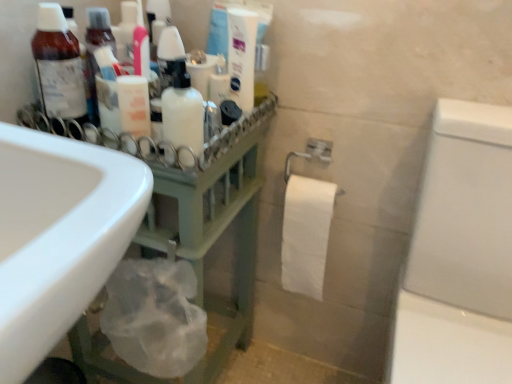
Identify the location of matte brown bottle at left. This screenshot has width=512, height=384. (58, 66).

In order to face matte brown bottle at left, should I rotate leftwards or rightwards?

Turn left by 24.702 degrees to look at matte brown bottle at left.

Image resolution: width=512 pixels, height=384 pixels. What are the coordinates of `white glossy toilet at right` in the screenshot? It's located at (460, 254).

Find the location of a particular element. The width and height of the screenshot is (512, 384). white glossy toothpaste tube at upper center is located at coordinates (242, 56).

What is the approximate height of white glossy toothpaste tube at upper center?

white glossy toothpaste tube at upper center is 8.11 inches tall.

Where is `white matte bottle at center`? white matte bottle at center is located at coordinates (183, 111).

This screenshot has height=384, width=512. I want to click on matte brown bottle at left, so click(58, 66).

Considering the positions of objects green matte rack at left and white glossy toothpaste tube at upper center in the image provided, who is more to the left, green matte rack at left or white glossy toothpaste tube at upper center?

green matte rack at left is more to the left.

Is point (83, 362) positioned behind point (252, 75)?

Yes, it is.

From the image's perspective, is green matte rack at left over white glossy toothpaste tube at upper center?

Result: Actually, green matte rack at left appears below white glossy toothpaste tube at upper center in the image.

Considering the relative sizes of green matte rack at left and white glossy toothpaste tube at upper center in the image provided, is green matte rack at left smaller than white glossy toothpaste tube at upper center?

Incorrect, green matte rack at left is not smaller in size than white glossy toothpaste tube at upper center.

Is point (85, 96) positioned after point (457, 264)?

No, it is in front of (457, 264).

Looking at this image, from the image's perspective, would you say matte brown bottle at left is positioned over white glossy toilet at right?

Yes, from the image's perspective, matte brown bottle at left is on top of white glossy toilet at right.

Is white glossy toilet at right surrounded by matte brown bottle at left?

No, white glossy toilet at right is not surrounded by matte brown bottle at left.

Is matte brown bottle at left bigger or smaller than white glossy toilet at right?

Clearly, matte brown bottle at left is smaller in size than white glossy toilet at right.

Who is taller, white glossy toilet at right or white glossy toothpaste tube at upper center?

white glossy toilet at right.

Can you tell me how much white glossy toilet at right and white glossy toothpaste tube at upper center differ in facing direction?

38.1 degrees separate the facing orientations of white glossy toilet at right and white glossy toothpaste tube at upper center.

Considering the sizes of white glossy toilet at right and white glossy toothpaste tube at upper center in the image, is white glossy toilet at right wider or thinner than white glossy toothpaste tube at upper center?

white glossy toilet at right is wider than white glossy toothpaste tube at upper center.

Is matte brown bottle at left smaller than white matte bottle at center?

Incorrect, matte brown bottle at left is not smaller in size than white matte bottle at center.

Where is `mouthwash on the right of matte brown bottle at left`? mouthwash on the right of matte brown bottle at left is located at coordinates (183, 111).

Which is more to the left, matte brown bottle at left or white matte bottle at center?

From the viewer's perspective, matte brown bottle at left appears more on the left side.

Who is shorter, white matte bottle at center or green matte rack at left?

Standing shorter between the two is white matte bottle at center.

Looking at this image, would you say white matte bottle at center is outside green matte rack at left?

Indeed, white matte bottle at center is completely outside green matte rack at left.

From the image's perspective, does white matte bottle at center appear higher than green matte rack at left?

Yes.

Would you say white glossy toothpaste tube at upper center is outside matte brown bottle at left?

white glossy toothpaste tube at upper center is positioned outside matte brown bottle at left.

Does white glossy toothpaste tube at upper center turn towards matte brown bottle at left?

Yes, white glossy toothpaste tube at upper center is turned towards matte brown bottle at left.

From a real-world perspective, is white glossy toothpaste tube at upper center beneath matte brown bottle at left?

No, from a real-world perspective, white glossy toothpaste tube at upper center is not under matte brown bottle at left.

Does point (250, 89) lie behind point (50, 52)?

Yes, point (250, 89) is farther from viewer.

Between green matte rack at left and white glossy toilet at right, which one is positioned in front?

white glossy toilet at right is more forward.

Considering the sizes of green matte rack at left and white glossy toilet at right in the image, is green matte rack at left wider or thinner than white glossy toilet at right?

Considering their sizes, green matte rack at left looks slimmer than white glossy toilet at right.

Considering the positions of objects green matte rack at left and white glossy toilet at right in the image provided, who is more to the right, green matte rack at left or white glossy toilet at right?

white glossy toilet at right is more to the right.

From the image's perspective, between green matte rack at left and white glossy toilet at right, which one is located above?

green matte rack at left appears higher in the image.

The height and width of the screenshot is (384, 512). Find the location of `cleaning product positioned vertically above the green matte rack at left (from a real-world perspective)`. cleaning product positioned vertically above the green matte rack at left (from a real-world perspective) is located at coordinates (242, 56).

Find the location of a particular element. Image resolution: width=512 pixels, height=384 pixels. bottle that appears above the white glossy toilet at right (from the image's perspective) is located at coordinates (58, 66).

Looking at the image, which one is located further to white matte bottle at center, white glossy toilet at right or matte brown bottle at left?

Based on the image, white glossy toilet at right appears to be further to white matte bottle at center.

Estimate the real-world distances between objects in this image. Which object is closer to white glossy toothpaste tube at upper center, white matte bottle at center or white matte lotion at center?

white matte bottle at center is positioned closer to the anchor white glossy toothpaste tube at upper center.

Looking at the image, which one is located further to white matte bottle at center, white matte lotion at center or green matte rack at left?

The object further to white matte bottle at center is green matte rack at left.

Looking at the image, which one is located closer to matte brown bottle at left, white glossy toothpaste tube at upper center or white matte lotion at center?

Based on the image, white matte lotion at center appears to be nearer to matte brown bottle at left.

Based on their spatial positions, is white matte bottle at center or white glossy toilet at right closer to white glossy toothpaste tube at upper center?

white matte bottle at center is positioned closer to the anchor white glossy toothpaste tube at upper center.

Which object lies further to the anchor point white glossy toothpaste tube at upper center, matte brown bottle at left or green matte rack at left?

Based on the image, green matte rack at left appears to be further to white glossy toothpaste tube at upper center.

Looking at this image, from the image, which object appears to be farther from white matte lotion at center, white matte bottle at center or green matte rack at left?

Among the two, green matte rack at left is located further to white matte lotion at center.

Which object lies nearer to the anchor point green matte rack at left, matte brown bottle at left or white glossy toilet at right?

Based on the image, matte brown bottle at left appears to be nearer to green matte rack at left.

Where is `mouthwash between white glossy toothpaste tube at upper center and green matte rack at left from top to bottom`? The width and height of the screenshot is (512, 384). mouthwash between white glossy toothpaste tube at upper center and green matte rack at left from top to bottom is located at coordinates (183, 111).

Locate an element on the screen. toiletry between white glossy toothpaste tube at upper center and green matte rack at left in the up-down direction is located at coordinates (134, 105).

Locate an element on the screen. The image size is (512, 384). toiletry between matte brown bottle at left and white matte bottle at center in the horizontal direction is located at coordinates (134, 105).

The height and width of the screenshot is (384, 512). I want to click on mouthwash situated between matte brown bottle at left and white glossy toilet at right from left to right, so click(x=183, y=111).